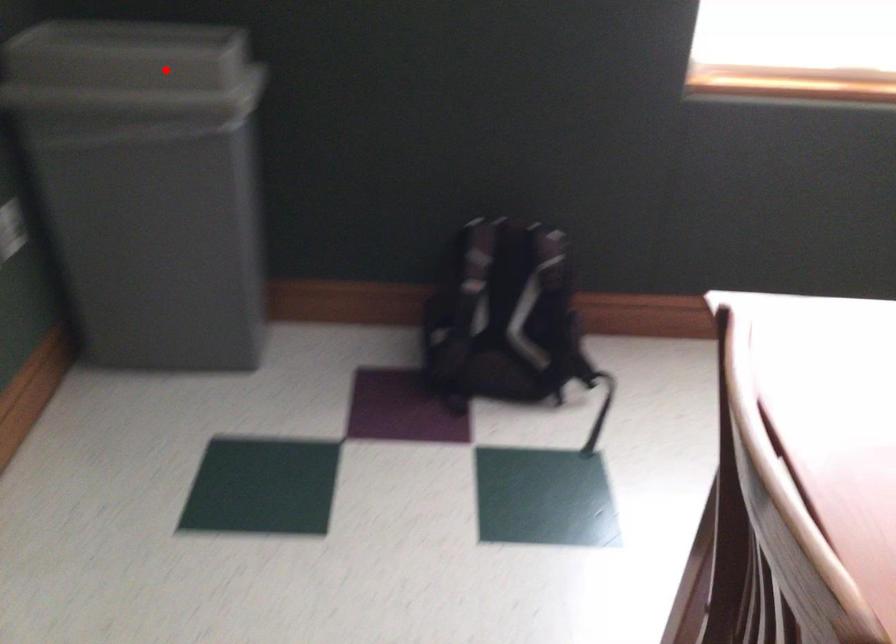
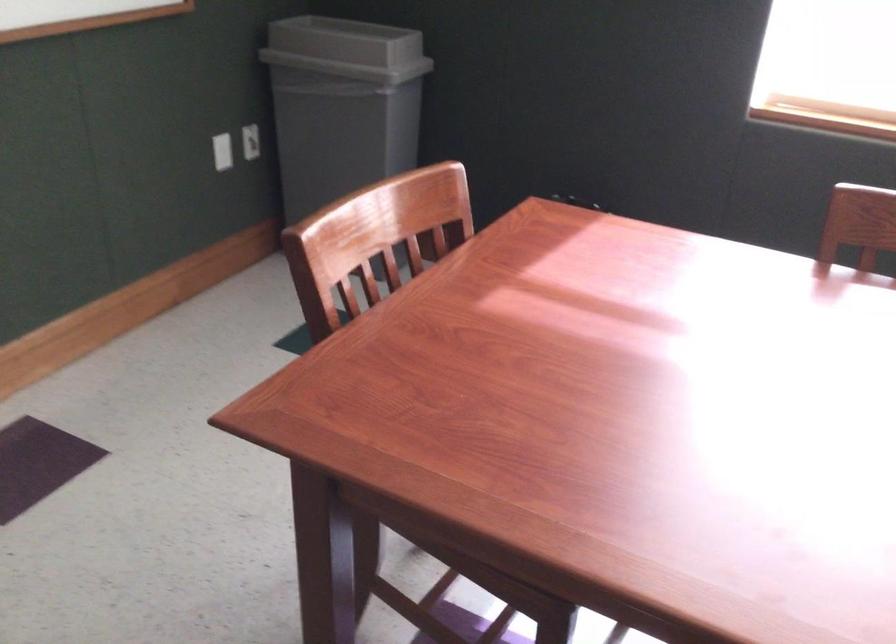
Question: I am providing you with two images of the same scene from different viewpoints. A red point is shown in image1. For the corresponding object point in image2, is it positioned nearer or farther from the camera?

Choices:
 (A) Nearer
 (B) Farther

Answer: (B)